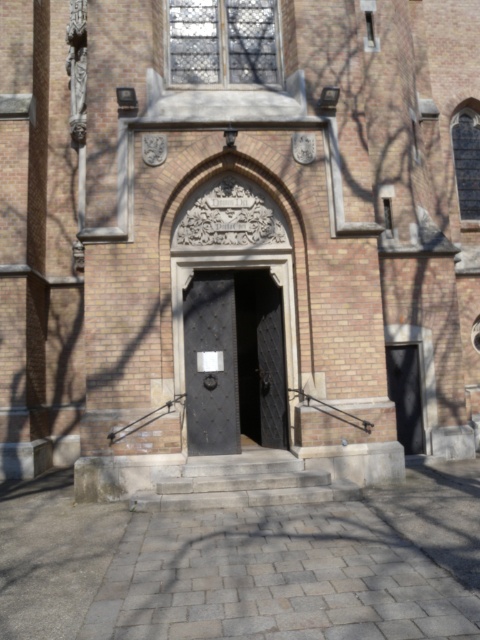
Question: Is black textured door at center below black matte door at right?

Choices:
 (A) yes
 (B) no

Answer: (B)

Question: Can you confirm if black textured door at center is positioned below black matte door at right?

Choices:
 (A) no
 (B) yes

Answer: (A)

Question: Is the position of black textured door at center less distant than that of black matte door at right?

Choices:
 (A) no
 (B) yes

Answer: (B)